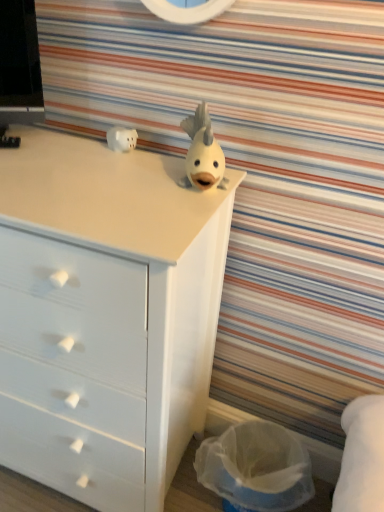
Question: Is white matte chest of drawers at upper center in contact with white matte piggy bank at upper left, which is counted as the second toy, starting from the right?

Choices:
 (A) yes
 (B) no

Answer: (B)

Question: Is white matte chest of drawers at upper center further to the viewer compared to white matte piggy bank at upper left, which is counted as the second toy, starting from the right?

Choices:
 (A) yes
 (B) no

Answer: (B)

Question: Does white matte chest of drawers at upper center have a lesser width compared to white matte piggy bank at upper left, placed as the 1th toy when sorted from back to front?

Choices:
 (A) yes
 (B) no

Answer: (B)

Question: From a real-world perspective, is white matte chest of drawers at upper center below white matte piggy bank at upper left, placed as the 1th toy when sorted from back to front?

Choices:
 (A) no
 (B) yes

Answer: (B)

Question: Considering the relative positions of white matte chest of drawers at upper center and white matte piggy bank at upper left, which is counted as the second toy, starting from the right, in the image provided, is white matte chest of drawers at upper center to the left of white matte piggy bank at upper left, which is counted as the second toy, starting from the right, from the viewer's perspective?

Choices:
 (A) no
 (B) yes

Answer: (B)

Question: Considering the positions of point (244, 470) and point (112, 137), is point (244, 470) closer or farther from the camera than point (112, 137)?

Choices:
 (A) farther
 (B) closer

Answer: (A)

Question: Is translucent plastic laundry basket at lower right taller or shorter than white matte piggy bank at upper left, the 1th toy in the left-to-right sequence?

Choices:
 (A) tall
 (B) short

Answer: (A)

Question: From a real-world perspective, is translucent plastic laundry basket at lower right above or below white matte piggy bank at upper left, which is counted as the second toy, starting from the right?

Choices:
 (A) above
 (B) below

Answer: (B)

Question: From the image's perspective, is translucent plastic laundry basket at lower right positioned above or below white matte piggy bank at upper left, the second toy positioned from the front?

Choices:
 (A) below
 (B) above

Answer: (A)

Question: Considering the positions of translucent plastic laundry basket at lower right and white matte chest of drawers at upper center in the image, is translucent plastic laundry basket at lower right wider or thinner than white matte chest of drawers at upper center?

Choices:
 (A) thin
 (B) wide

Answer: (A)

Question: Considering the positions of translucent plastic laundry basket at lower right and white matte chest of drawers at upper center in the image, is translucent plastic laundry basket at lower right taller or shorter than white matte chest of drawers at upper center?

Choices:
 (A) tall
 (B) short

Answer: (B)

Question: From the image's perspective, is translucent plastic laundry basket at lower right located above or below white matte chest of drawers at upper center?

Choices:
 (A) below
 (B) above

Answer: (A)

Question: From a real-world perspective, is translucent plastic laundry basket at lower right above or below white matte chest of drawers at upper center?

Choices:
 (A) below
 (B) above

Answer: (A)

Question: From a real-world perspective, is white matte fish at center, the second toy positioned from the back, physically located above or below white matte chest of drawers at upper center?

Choices:
 (A) above
 (B) below

Answer: (A)

Question: In terms of height, does white matte fish at center, the second toy positioned from the back, look taller or shorter compared to white matte chest of drawers at upper center?

Choices:
 (A) short
 (B) tall

Answer: (A)